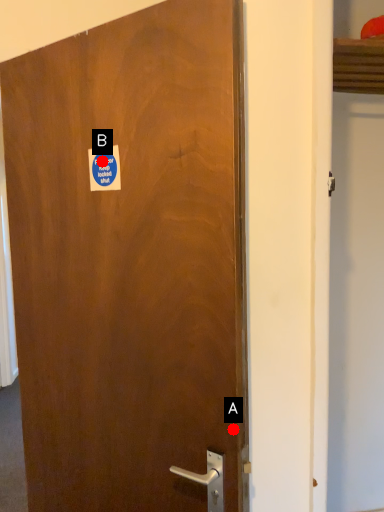
Question: Two points are circled on the image, labeled by A and B beside each circle. Among these points, which one is nearest to the camera?

Choices:
 (A) A is closer
 (B) B is closer

Answer: (A)